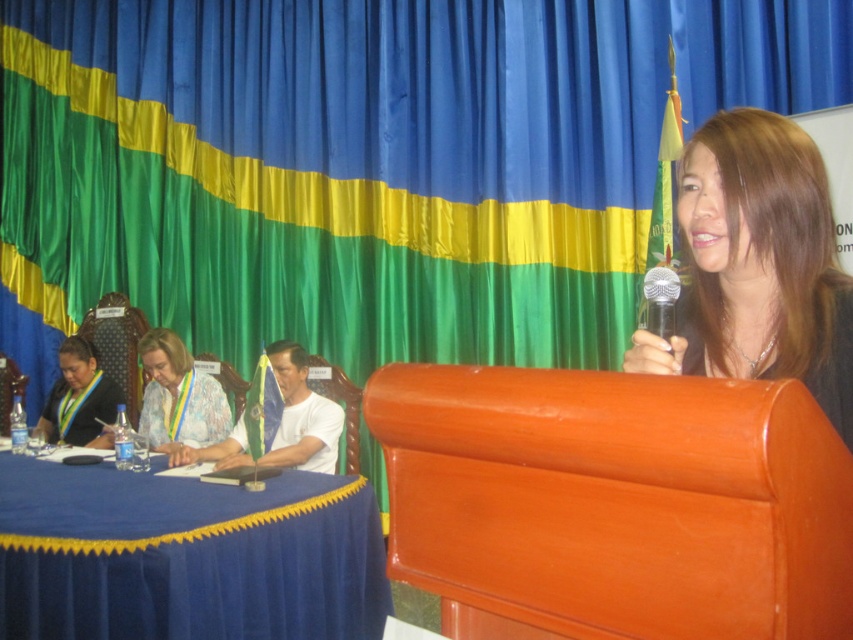
Question: Considering the relative positions of brown hair at upper right and matte black shirt at left in the image provided, where is brown hair at upper right located with respect to matte black shirt at left?

Choices:
 (A) below
 (B) above

Answer: (B)

Question: Which of these objects is positioned closest to the blue fabric table at lower left?

Choices:
 (A) white matte shirt at center
 (B) silver metallic microphone at upper center
 (C) brown hair at upper right

Answer: (A)

Question: Is brown hair at upper right to the left of white matte shirt at center from the viewer's perspective?

Choices:
 (A) yes
 (B) no

Answer: (B)

Question: Is matte black shirt at left wider than silver metallic microphone at upper center?

Choices:
 (A) no
 (B) yes

Answer: (B)

Question: Which is nearer to the white matte shirt at center?

Choices:
 (A) blue fabric table at lower left
 (B) brown hair at upper right
 (C) matte black shirt at left

Answer: (A)

Question: Which of the following is the closest to the observer?

Choices:
 (A) silver metallic microphone at upper center
 (B) matte black shirt at left
 (C) brown hair at upper right

Answer: (C)